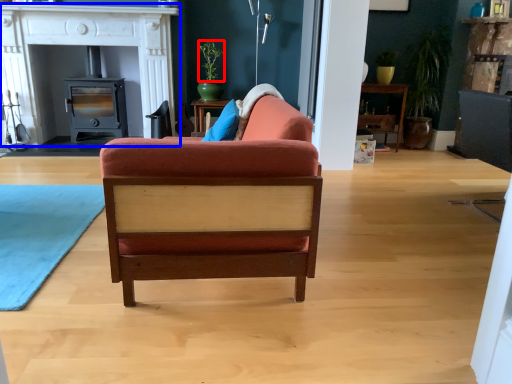
Question: Which object appears farthest to the camera in this image, plant (highlighted by a red box) or fireplace (highlighted by a blue box)?

Choices:
 (A) plant
 (B) fireplace

Answer: (A)